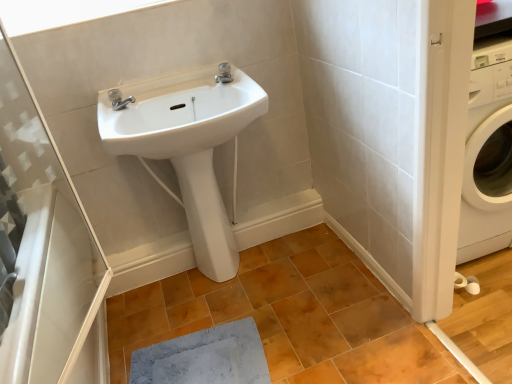
You are a GUI agent. You are given a task and a screenshot of the screen. Output one action in this format:
    pyautogui.click(x=<x>, y=<y>)
    Task: Click on the free space underneath white glossy bidet at center (from a real-world perspective)
    The image size is (512, 384).
    Given the screenshot: What is the action you would take?
    pyautogui.click(x=229, y=277)